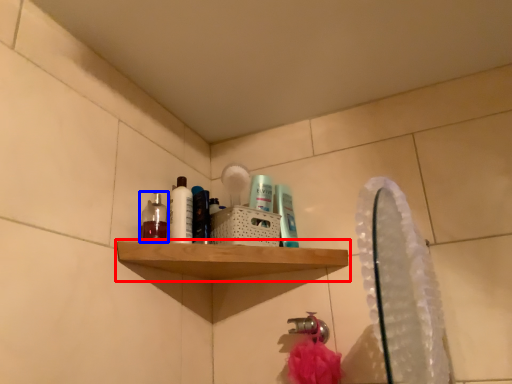
Question: Which object appears farthest to the camera in this image, shelf (highlighted by a red box) or mouthwash (highlighted by a blue box)?

Choices:
 (A) shelf
 (B) mouthwash

Answer: (B)